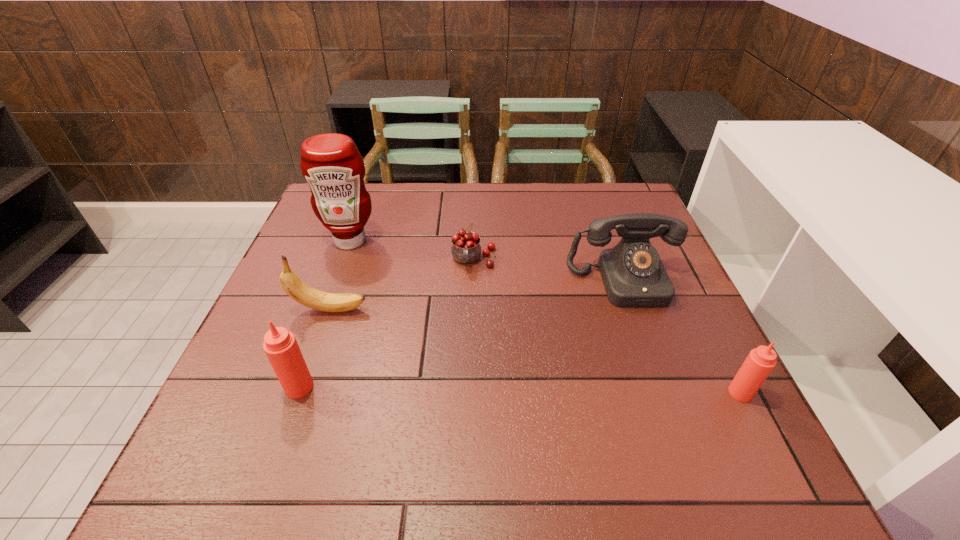
Find the location of a particular element. free spot located at the start of the peel on the banana is located at coordinates (403, 309).

At what (x,y) coordinates should I click in order to perform the action: click on vacant space located 0.130m on the dial of the telephone. Please return your answer as a coordinate pair (x, y). The height and width of the screenshot is (540, 960). Looking at the image, I should click on (650, 353).

I want to click on vacant space situated 0.080m on the back of the tallest object, so click(360, 213).

Where is `Tabasco sauce positioned at the left edge`? The width and height of the screenshot is (960, 540). Tabasco sauce positioned at the left edge is located at coordinates (280, 345).

This screenshot has width=960, height=540. In order to click on banana located at the left edge in this screenshot , I will do click(x=299, y=291).

Find the location of `condiment at the left edge`. condiment at the left edge is located at coordinates (331, 163).

Image resolution: width=960 pixels, height=540 pixels. In order to click on Tabasco sauce that is at the right edge in this screenshot , I will do `click(760, 362)`.

Where is `telephone at the right edge`? This screenshot has height=540, width=960. telephone at the right edge is located at coordinates (633, 275).

Locate an element on the screen. object at the near left corner is located at coordinates (280, 345).

At what (x,y) coordinates should I click in order to perform the action: click on object present at the near right corner. Please return your answer as a coordinate pair (x, y). The height and width of the screenshot is (540, 960). Looking at the image, I should click on (760, 362).